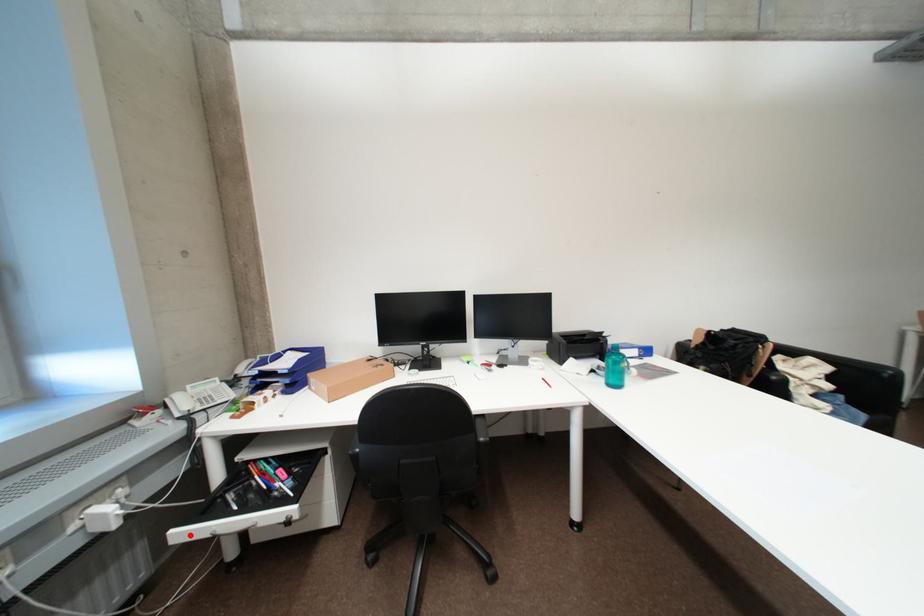
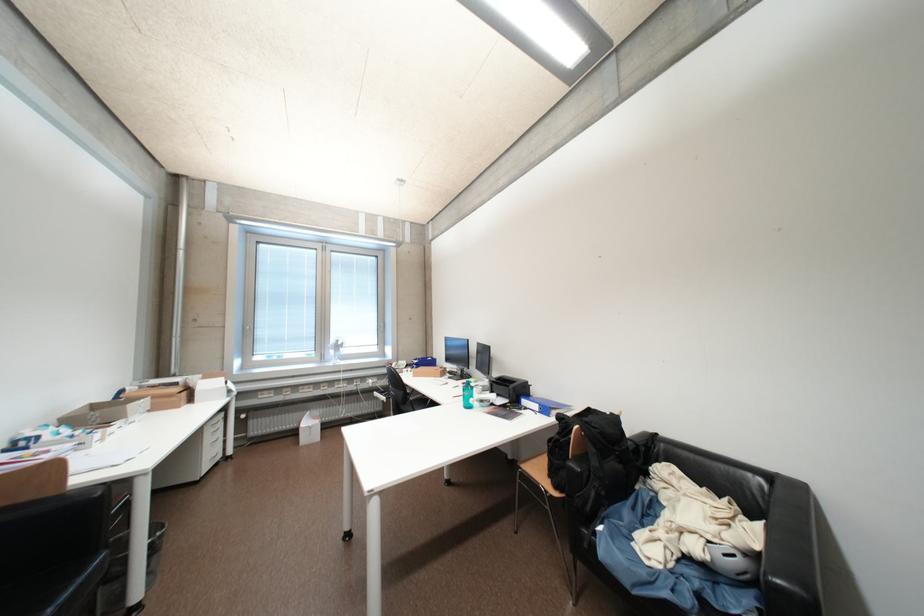
The point at the highlighted location is marked in the first image. Where is the corresponding point in the second image?

(383, 395)